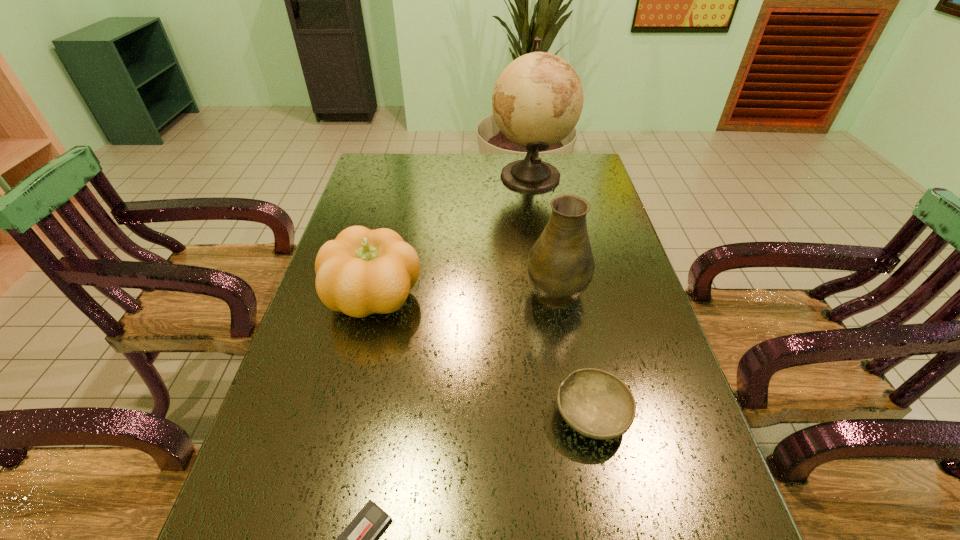
You are a GUI agent. You are given a task and a screenshot of the screen. Output one action in this format:
    pyautogui.click(x=<x>, y=<y>)
    Task: Click on the farthest object
    The width and height of the screenshot is (960, 540).
    Given the screenshot: What is the action you would take?
    pyautogui.click(x=537, y=100)

The image size is (960, 540). In order to click on globe in this screenshot , I will do `click(537, 100)`.

At what (x,y) coordinates should I click in order to perform the action: click on pitcher. Please return your answer as a coordinate pair (x, y). This screenshot has width=960, height=540. Looking at the image, I should click on (560, 265).

Locate an element on the screen. the third shortest object is located at coordinates (361, 272).

Locate an element on the screen. The width and height of the screenshot is (960, 540). the fourth farthest object is located at coordinates (595, 403).

Where is `bowl`? Image resolution: width=960 pixels, height=540 pixels. bowl is located at coordinates (595, 403).

Locate an element on the screen. Image resolution: width=960 pixels, height=540 pixels. free space located on the front-facing side of the globe is located at coordinates (419, 176).

Find the location of `free location located 0.290m on the front-facing side of the globe`. free location located 0.290m on the front-facing side of the globe is located at coordinates (411, 176).

Locate an element on the screen. The width and height of the screenshot is (960, 540). free space located on the front-facing side of the globe is located at coordinates (433, 176).

Locate an element on the screen. vacant space located 0.210m on the handle side of the pitcher is located at coordinates (543, 221).